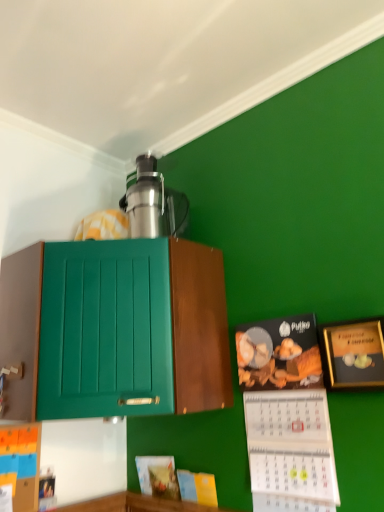
This screenshot has width=384, height=512. Describe the element at coordinates (115, 328) in the screenshot. I see `green matte cabinet at upper left` at that location.

This screenshot has width=384, height=512. What do you see at coordinates (158, 476) in the screenshot?
I see `matte paper book at lower center, which ranks as the third book in right-to-left order` at bounding box center [158, 476].

What is the approximate width of matte yellow book at lower center, the 2th book when ordered from right to left?

It is 1.09 inches.

What do you see at coordinates (355, 354) in the screenshot?
I see `gold-framed picture at upper right` at bounding box center [355, 354].

Find the location of a particular element. This screenshot has width=384, height=512. green matte cabinet at upper left is located at coordinates 115,328.

What's the angular difference between gold-framed picture at upper right and matte yellow book at lower center, the 3th book viewed from the left,'s facing directions?

4 degrees separate the facing orientations of gold-framed picture at upper right and matte yellow book at lower center, the 3th book viewed from the left.

Consider the image. Would you say gold-framed picture at upper right contains matte yellow book at lower center, the 3th book viewed from the left?

Definitely not — matte yellow book at lower center, the 3th book viewed from the left, is not inside gold-framed picture at upper right.

Which of these two, gold-framed picture at upper right or matte yellow book at lower center, the 2th book when ordered from right to left, stands shorter?

With less height is matte yellow book at lower center, the 2th book when ordered from right to left.

In the scene shown: Is gold-framed picture at upper right smaller than matte yellow book at lower center, the 3th book viewed from the left?

Incorrect, gold-framed picture at upper right is not smaller in size than matte yellow book at lower center, the 3th book viewed from the left.

From a real-world perspective, is orange matte board at lower left, arranged as the 1th book when viewed from the left, physically above matte yellow book at lower center, the 2th book when ordered from right to left?

Yes.

Image resolution: width=384 pixels, height=512 pixels. I want to click on the 1st book behind the orange matte board at lower left, the fourth book when ordered from right to left, so click(197, 487).

Is matte yellow book at lower center, the 2th book when ordered from right to left, bigger than satin silver thermos at upper center?

No.

Could you measure the distance between matte yellow book at lower center, the 2th book when ordered from right to left, and satin silver thermos at upper center?

matte yellow book at lower center, the 2th book when ordered from right to left, and satin silver thermos at upper center are 3.30 feet apart from each other.

From a real-world perspective, who is located lower, matte yellow book at lower center, the 2th book when ordered from right to left, or satin silver thermos at upper center?

matte yellow book at lower center, the 2th book when ordered from right to left.

Is satin silver thermos at upper center located within matte yellow book at lower center, the 2th book when ordered from right to left?

No.

Considering the sizes of gold-framed picture at upper right and matte paper book at lower center, which ranks as the third book in right-to-left order, in the image, is gold-framed picture at upper right wider or thinner than matte paper book at lower center, which ranks as the third book in right-to-left order,?

Considering their sizes, gold-framed picture at upper right looks broader than matte paper book at lower center, which ranks as the third book in right-to-left order.

Is gold-framed picture at upper right shorter than matte paper book at lower center, arranged as the 2th book when viewed from the left?

No.

From the image's perspective, does gold-framed picture at upper right appear lower than matte paper book at lower center, arranged as the 2th book when viewed from the left?

No.

How distant is satin silver thermos at upper center from matte yellow book at lower center, the 3th book viewed from the left?

They are 3.30 feet apart.

Is satin silver thermos at upper center facing away from matte yellow book at lower center, the 3th book viewed from the left?

No, satin silver thermos at upper center's orientation is not away from matte yellow book at lower center, the 3th book viewed from the left.

Locate an element on the screen. book that is the 3rd object located below the satin silver thermos at upper center (from the image's perspective) is located at coordinates (197, 487).

Is satin silver thermos at upper center in contact with matte yellow book at lower center, the 3th book viewed from the left?

No.

From the image's perspective, is matte black calendar at lower right, which is the fourth book in left-to-right order, located above or below gold-framed picture at upper right?

matte black calendar at lower right, which is the fourth book in left-to-right order, is below gold-framed picture at upper right.

From a real-world perspective, which is physically above, matte black calendar at lower right, which is the fourth book in left-to-right order, or gold-framed picture at upper right?

gold-framed picture at upper right is physically above.

From the picture: From the image's perspective, is green matte cabinet at upper left below matte yellow book at lower center, the 2th book when ordered from right to left?

No, from the image's perspective, green matte cabinet at upper left is not below matte yellow book at lower center, the 2th book when ordered from right to left.

Locate an element on the screen. The width and height of the screenshot is (384, 512). the 2nd book counting from the right of the green matte cabinet at upper left is located at coordinates (197, 487).

Can you confirm if green matte cabinet at upper left is wider than matte yellow book at lower center, the 2th book when ordered from right to left?

Correct, the width of green matte cabinet at upper left exceeds that of matte yellow book at lower center, the 2th book when ordered from right to left.

How much distance is there between green matte cabinet at upper left and matte yellow book at lower center, the 3th book viewed from the left?

The distance of green matte cabinet at upper left from matte yellow book at lower center, the 3th book viewed from the left, is 24.54 inches.

Image resolution: width=384 pixels, height=512 pixels. Find the location of `picture frame above the matte yellow book at lower center, the 3th book viewed from the left (from a real-world perspective)`. picture frame above the matte yellow book at lower center, the 3th book viewed from the left (from a real-world perspective) is located at coordinates (355, 354).

The height and width of the screenshot is (512, 384). In order to click on the 2nd book counting from the right side of the orange matte board at lower left, arranged as the 1th book when viewed from the left in this screenshot , I will do `click(197, 487)`.

Considering their positions, is matte black calendar at lower right, which ranks as the 1th book in right-to-left order, positioned closer to orange matte board at lower left, the fourth book when ordered from right to left, than satin silver thermos at upper center?

Based on the image, matte black calendar at lower right, which ranks as the 1th book in right-to-left order, appears to be nearer to orange matte board at lower left, the fourth book when ordered from right to left.

Looking at the image, which one is located closer to matte paper book at lower center, arranged as the 2th book when viewed from the left, orange matte board at lower left, arranged as the 1th book when viewed from the left, or matte yellow book at lower center, the 3th book viewed from the left?

matte yellow book at lower center, the 3th book viewed from the left.

When comparing their distances from gold-framed picture at upper right, does satin silver thermos at upper center or green matte cabinet at upper left seem closer?

Among the two, green matte cabinet at upper left is located nearer to gold-framed picture at upper right.

Looking at the image, which one is located further to matte black calendar at lower right, which is the fourth book in left-to-right order, satin silver thermos at upper center or orange matte board at lower left, arranged as the 1th book when viewed from the left?

Based on the image, orange matte board at lower left, arranged as the 1th book when viewed from the left, appears to be further to matte black calendar at lower right, which is the fourth book in left-to-right order.

When comparing their distances from gold-framed picture at upper right, does satin silver thermos at upper center or matte black calendar at lower right, which ranks as the 1th book in right-to-left order, seem closer?

matte black calendar at lower right, which ranks as the 1th book in right-to-left order.

Looking at the image, which one is located further to gold-framed picture at upper right, matte yellow book at lower center, the 2th book when ordered from right to left, or matte paper book at lower center, arranged as the 2th book when viewed from the left?

Based on the image, matte paper book at lower center, arranged as the 2th book when viewed from the left, appears to be further to gold-framed picture at upper right.

Based on their spatial positions, is green matte cabinet at upper left or matte yellow book at lower center, the 3th book viewed from the left, further from orange matte board at lower left, arranged as the 1th book when viewed from the left?

matte yellow book at lower center, the 3th book viewed from the left, is positioned further to the anchor orange matte board at lower left, arranged as the 1th book when viewed from the left.

From the image, which object appears to be farther from green matte cabinet at upper left, satin silver thermos at upper center or gold-framed picture at upper right?

The object further to green matte cabinet at upper left is gold-framed picture at upper right.

The image size is (384, 512). Identify the location of cabinetry that lies between satin silver thermos at upper center and orange matte board at lower left, the fourth book when ordered from right to left, from top to bottom. (115, 328).

Find the location of a particular element. The width and height of the screenshot is (384, 512). cabinetry between satin silver thermos at upper center and matte black calendar at lower right, which ranks as the 1th book in right-to-left order, from top to bottom is located at coordinates (115, 328).

The image size is (384, 512). I want to click on picture frame between satin silver thermos at upper center and matte black calendar at lower right, which ranks as the 1th book in right-to-left order, in the vertical direction, so click(x=355, y=354).

Locate an element on the screen. This screenshot has height=512, width=384. cabinetry between satin silver thermos at upper center and matte yellow book at lower center, the 3th book viewed from the left, in the vertical direction is located at coordinates (115, 328).